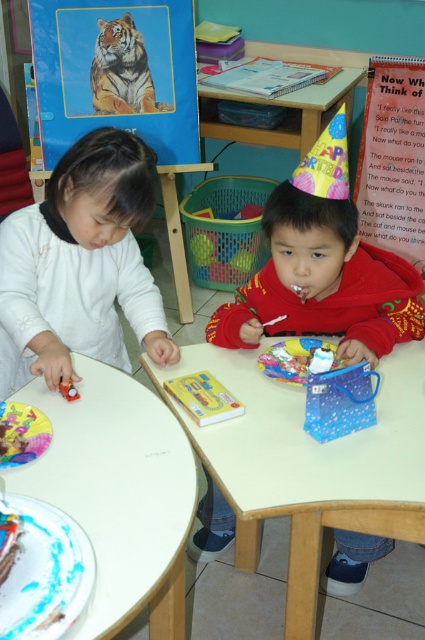
Question: Can you confirm if white glossy table at lower left is positioned above red velvet cake at upper center?

Choices:
 (A) no
 (B) yes

Answer: (A)

Question: Considering the relative positions of white matte shirt at left and red velvet cake at upper center in the image provided, where is white matte shirt at left located with respect to red velvet cake at upper center?

Choices:
 (A) right
 (B) left

Answer: (B)

Question: Which point is farther from the camera taking this photo?

Choices:
 (A) (99, 394)
 (B) (331, 237)
 (C) (422, 177)
 (D) (130, 205)

Answer: (C)

Question: Does white glossy table at center appear on the left side of wooden table at upper center?

Choices:
 (A) yes
 (B) no

Answer: (A)

Question: Estimate the real-world distances between objects in this image. Which object is closer to the red velvet cake at upper center?

Choices:
 (A) white glossy table at center
 (B) wooden table at upper center
 (C) white matte shirt at left
 (D) white glossy table at lower left

Answer: (A)

Question: Which object is the farthest from the white glossy table at center?

Choices:
 (A) red velvet cake at upper center
 (B) wooden table at upper center
 (C) cardboard paper at upper right
 (D) white glossy table at lower left

Answer: (B)